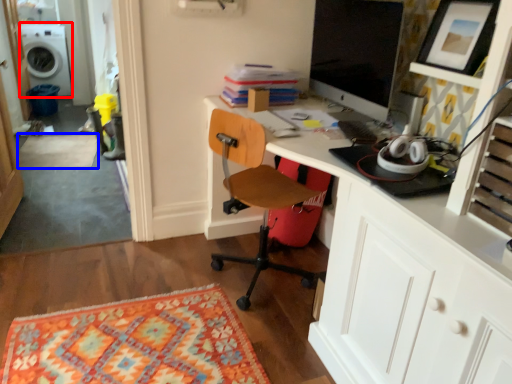
Question: Among these objects, which one is nearest to the camera, washing machine (highlighted by a red box) or mat (highlighted by a blue box)?

Choices:
 (A) washing machine
 (B) mat

Answer: (B)